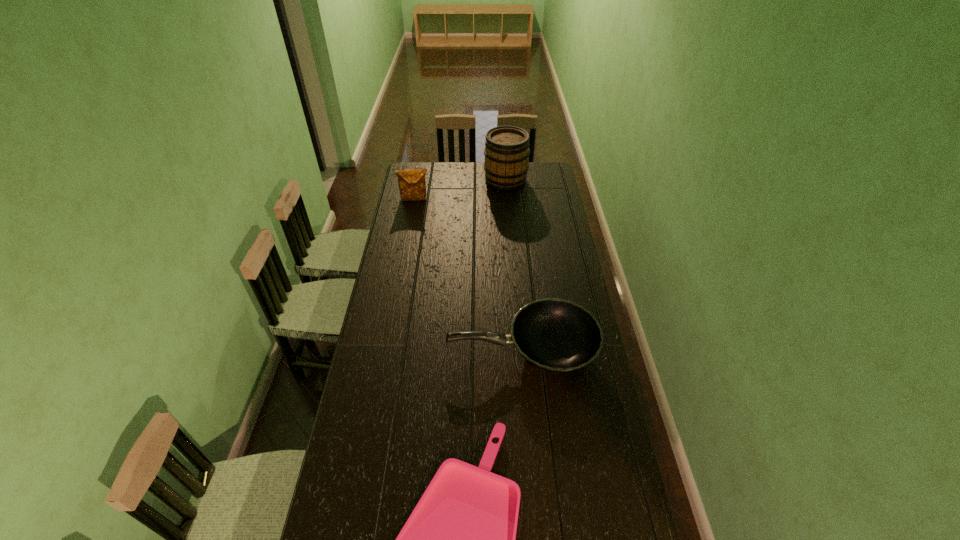
Where is `object at the left edge`? object at the left edge is located at coordinates tap(412, 185).

You are a GUI agent. You are given a task and a screenshot of the screen. Output one action in this format:
    pyautogui.click(x=<x>, y=<y>)
    Task: Click on the object located in the right edge section of the desktop
    
    Given the screenshot: What is the action you would take?
    pyautogui.click(x=558, y=336)

Identify the location of vacant space at the far edge of the desktop. (447, 176).

This screenshot has width=960, height=540. In order to click on free spot at the left edge of the desktop in this screenshot , I will do `click(402, 356)`.

The image size is (960, 540). In the image, there is a desktop. In order to click on blank space at the right edge in this screenshot , I will do `click(580, 416)`.

The height and width of the screenshot is (540, 960). In the image, there is a desktop. Identify the location of vacant space at the far left corner. (425, 181).

Identify the location of free space at the far right corner. This screenshot has width=960, height=540. (539, 173).

At what (x,y) coordinates should I click in order to perform the action: click on free space that is in between the frying pan and the leftmost object. Please return your answer as a coordinate pair (x, y). Looking at the image, I should click on (468, 275).

What are the coordinates of `vacant space that is in between the second shortest object and the cider` in the screenshot? It's located at (514, 266).

At what (x,y) coordinates should I click in order to perform the action: click on object that can be found as the second closest to the frying pan. Please return your answer as a coordinate pair (x, y). The height and width of the screenshot is (540, 960). Looking at the image, I should click on (412, 185).